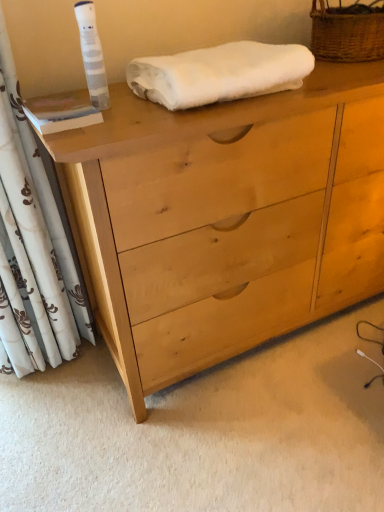
Question: Can you confirm if white floral fabric curtain at left is wider than woven brown basket at upper right?

Choices:
 (A) yes
 (B) no

Answer: (B)

Question: Does white floral fabric curtain at left have a greater height compared to woven brown basket at upper right?

Choices:
 (A) yes
 (B) no

Answer: (A)

Question: Is white floral fabric curtain at left bigger than woven brown basket at upper right?

Choices:
 (A) yes
 (B) no

Answer: (A)

Question: Is white floral fabric curtain at left at the left side of woven brown basket at upper right?

Choices:
 (A) yes
 (B) no

Answer: (A)

Question: Is white floral fabric curtain at left outside woven brown basket at upper right?

Choices:
 (A) no
 (B) yes

Answer: (B)

Question: Considering the relative sizes of white floral fabric curtain at left and woven brown basket at upper right in the image provided, is white floral fabric curtain at left shorter than woven brown basket at upper right?

Choices:
 (A) yes
 (B) no

Answer: (B)

Question: Is light wood chest of drawers at center taller than woven brown basket at upper right?

Choices:
 (A) no
 (B) yes

Answer: (B)

Question: Is light wood chest of drawers at center looking in the opposite direction of woven brown basket at upper right?

Choices:
 (A) no
 (B) yes

Answer: (A)

Question: Is light wood chest of drawers at center outside woven brown basket at upper right?

Choices:
 (A) yes
 (B) no

Answer: (A)

Question: From a real-world perspective, is light wood chest of drawers at center located beneath woven brown basket at upper right?

Choices:
 (A) no
 (B) yes

Answer: (B)

Question: From the image's perspective, is light wood chest of drawers at center beneath woven brown basket at upper right?

Choices:
 (A) yes
 (B) no

Answer: (A)

Question: Can you confirm if light wood chest of drawers at center is bigger than woven brown basket at upper right?

Choices:
 (A) yes
 (B) no

Answer: (A)

Question: Would you consider white floral fabric curtain at left to be distant from white fluffy towel at upper center?

Choices:
 (A) yes
 (B) no

Answer: (B)